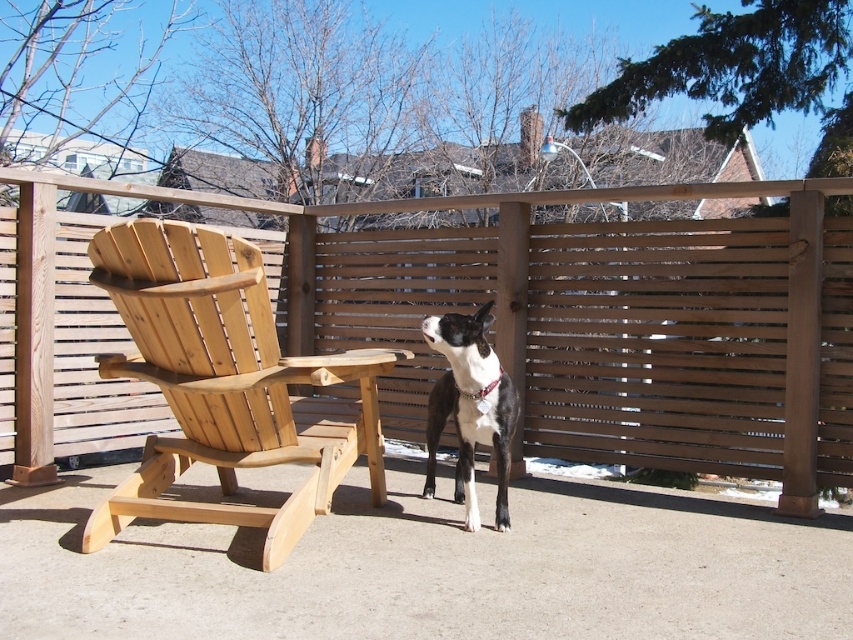
Question: Which object is closer to the camera taking this photo?

Choices:
 (A) natural wood rocking chair at left
 (B) black and white fur at center
 (C) light brown wood at center
 (D) brown wooden fence at center

Answer: (C)

Question: Which is farther from the black and white fur at center?

Choices:
 (A) brown wooden fence at center
 (B) light brown wood at center

Answer: (A)

Question: Can you confirm if brown wooden fence at center is thinner than natural wood rocking chair at left?

Choices:
 (A) yes
 (B) no

Answer: (B)

Question: From the image, what is the correct spatial relationship of brown wooden fence at center in relation to black and white fur at center?

Choices:
 (A) left
 (B) right

Answer: (B)

Question: Can you confirm if light brown wood at center is positioned to the right of natural wood rocking chair at left?

Choices:
 (A) yes
 (B) no

Answer: (A)

Question: Among these objects, which one is farthest from the camera?

Choices:
 (A) brown wooden fence at center
 (B) black and white fur at center
 (C) light brown wood at center
 (D) natural wood rocking chair at left

Answer: (A)